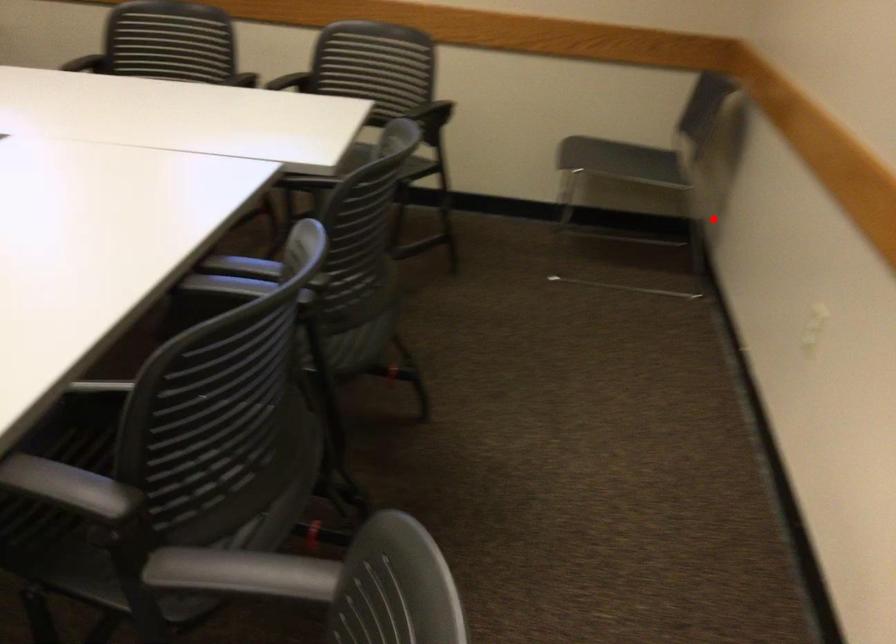
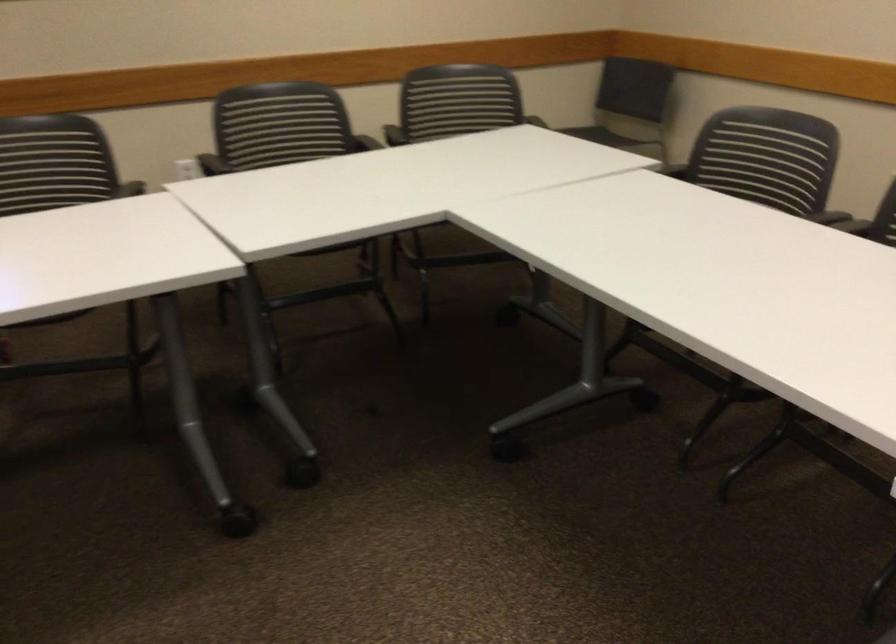
Locate, in the second image, the point that corresponds to the highlighted location in the first image.

(660, 158)